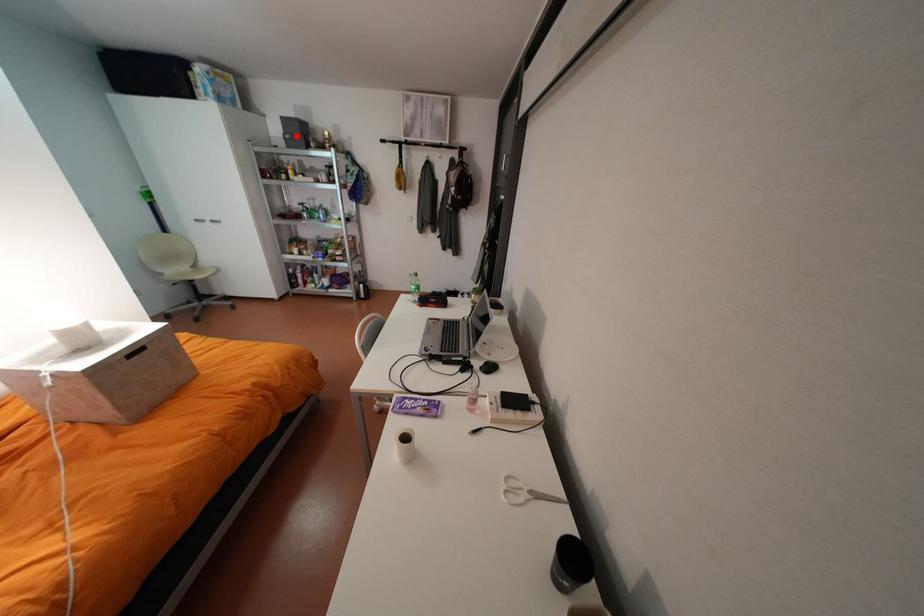
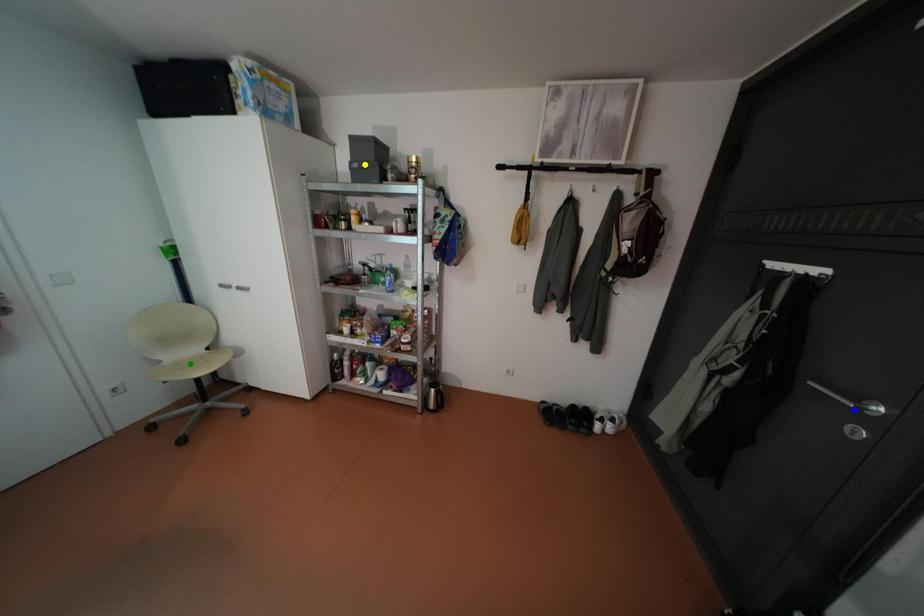
Question: I am providing you with two images of the same scene from different viewpoints. A red point is marked on the first image. You are given multiple points on the second image. Which mark in image 2 goes with the point in image 1?

Choices:
 (A) yellow point
 (B) blue point
 (C) green point

Answer: (A)